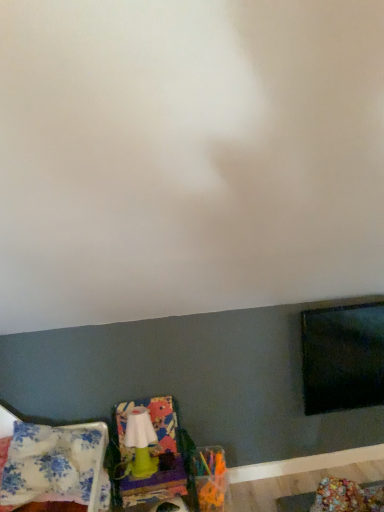
This screenshot has height=512, width=384. Find the location of `floral fabric pillow at lower left`. floral fabric pillow at lower left is located at coordinates (54, 466).

Locate an element on the screen. The height and width of the screenshot is (512, 384). green plastic swivel chair at lower left is located at coordinates (155, 454).

Find the location of a particular element. floral fabric pillow at lower left is located at coordinates (54, 466).

From a real-world perspective, is green matte lamp at lower left positioned above or below floral fabric pillow at lower left?

From a real-world perspective, green matte lamp at lower left is physically below floral fabric pillow at lower left.

Is green matte lamp at lower left wider or thinner than floral fabric pillow at lower left?

Clearly, green matte lamp at lower left has less width compared to floral fabric pillow at lower left.

In the scene shown: Can you tell me how much green matte lamp at lower left and floral fabric pillow at lower left differ in facing direction?

The angular difference between green matte lamp at lower left and floral fabric pillow at lower left is 2.67 degrees.

Does point (142, 434) appear closer or farther from the camera than point (34, 498)?

Point (142, 434) appears to be farther away from the viewer than point (34, 498).

Considering the relative positions of floral fabric pillow at lower left and green plastic swivel chair at lower left in the image provided, is floral fabric pillow at lower left to the right of green plastic swivel chair at lower left from the viewer's perspective?

No.

I want to click on swivel chair behind the floral fabric pillow at lower left, so click(155, 454).

Which of these two, floral fabric pillow at lower left or green plastic swivel chair at lower left, stands shorter?

floral fabric pillow at lower left is shorter.

How different are the orientations of green matte lamp at lower left and green plastic swivel chair at lower left in degrees?

The angle between the facing direction of green matte lamp at lower left and the facing direction of green plastic swivel chair at lower left is 0.0684 degrees.

Measure the distance between green matte lamp at lower left and green plastic swivel chair at lower left.

A distance of 1.98 inches exists between green matte lamp at lower left and green plastic swivel chair at lower left.

Is green matte lamp at lower left positioned with its back to green plastic swivel chair at lower left?

Yes, green matte lamp at lower left's orientation is away from green plastic swivel chair at lower left.

From a real-world perspective, relative to green plastic swivel chair at lower left, is green matte lamp at lower left vertically above or below?

green matte lamp at lower left is above green plastic swivel chair at lower left.

Which object is further away from the camera taking this photo, green plastic swivel chair at lower left or green matte lamp at lower left?

green matte lamp at lower left is further from the camera.

Can you confirm if green plastic swivel chair at lower left is taller than green matte lamp at lower left?

Yes.

Would you say green matte lamp at lower left is part of green plastic swivel chair at lower left's contents?

Yes.

Between green plastic swivel chair at lower left and green matte lamp at lower left, which one has larger size?

green plastic swivel chair at lower left.

Is green plastic swivel chair at lower left bigger or smaller than floral fabric pillow at lower left?

In the image, green plastic swivel chair at lower left appears to be larger than floral fabric pillow at lower left.

Could you tell me if green plastic swivel chair at lower left is turned towards floral fabric pillow at lower left?

No, green plastic swivel chair at lower left is not aimed at floral fabric pillow at lower left.

From the image's perspective, is green plastic swivel chair at lower left under floral fabric pillow at lower left?

Yes.

Which of these two, floral fabric pillow at lower left or green matte lamp at lower left, is smaller?

Smaller between the two is green matte lamp at lower left.

Is floral fabric pillow at lower left turned away from green matte lamp at lower left?

No, green matte lamp at lower left is not at the back of floral fabric pillow at lower left.

Are floral fabric pillow at lower left and green matte lamp at lower left making contact?

No, floral fabric pillow at lower left is not making contact with green matte lamp at lower left.

Find the location of `lamp behind the floral fabric pillow at lower left`. lamp behind the floral fabric pillow at lower left is located at coordinates pos(140,443).

There is a green plastic swivel chair at lower left. Where is `blanket above it (from a real-world perspective)`? blanket above it (from a real-world perspective) is located at coordinates (54, 466).

Which object lies nearer to the anchor point green matte lamp at lower left, green plastic swivel chair at lower left or floral fabric pillow at lower left?

green plastic swivel chair at lower left.

Looking at the image, which one is located further to green plastic swivel chair at lower left, floral fabric pillow at lower left or green matte lamp at lower left?

Among the two, floral fabric pillow at lower left is located further to green plastic swivel chair at lower left.

Which object lies further to the anchor point floral fabric pillow at lower left, green plastic swivel chair at lower left or green matte lamp at lower left?

Among the two, green matte lamp at lower left is located further to floral fabric pillow at lower left.

Looking at this image, considering their positions, is green matte lamp at lower left positioned closer to green plastic swivel chair at lower left than floral fabric pillow at lower left?

Among the two, green matte lamp at lower left is located nearer to green plastic swivel chair at lower left.

Looking at the image, which one is located closer to green matte lamp at lower left, floral fabric pillow at lower left or green plastic swivel chair at lower left?

The object closer to green matte lamp at lower left is green plastic swivel chair at lower left.

Based on their spatial positions, is green matte lamp at lower left or green plastic swivel chair at lower left closer to floral fabric pillow at lower left?

Based on the image, green plastic swivel chair at lower left appears to be nearer to floral fabric pillow at lower left.

You are a GUI agent. You are given a task and a screenshot of the screen. Output one action in this format:
    pyautogui.click(x=<x>, y=<y>)
    Task: Click on the lamp between floral fabric pillow at lower left and green plastic swivel chair at lower left
    
    Given the screenshot: What is the action you would take?
    (140, 443)